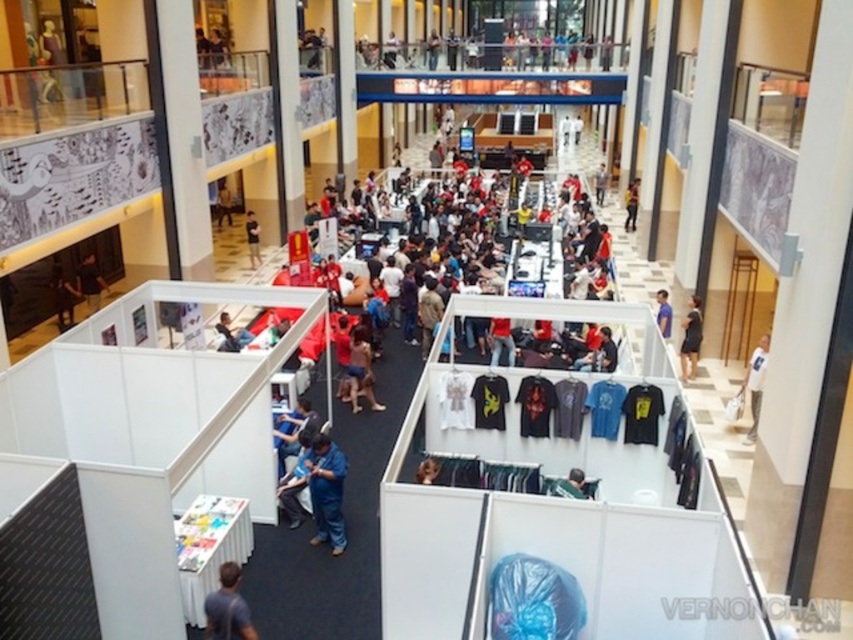
Question: Estimate the real-world distances between objects in this image. Which object is farther from the black fabric dress at lower right?

Choices:
 (A) blue fabric shirt at center
 (B) matte black shirt at center
 (C) yellow reflective vest at center

Answer: (B)

Question: Which object appears farthest from the camera in this image?

Choices:
 (A) blue fabric shirt at center
 (B) light brown skin at center

Answer: (A)

Question: Is blue fabric shirt at center behind yellow reflective vest at center?

Choices:
 (A) yes
 (B) no

Answer: (B)

Question: Which object is the farthest from the blue fabric shirt at center?

Choices:
 (A) blue jeans at lower center
 (B) yellow reflective vest at center
 (C) matte black shirt at center
 (D) dark blue shirt at lower center

Answer: (C)

Question: Observing the image, what is the correct spatial positioning of blue jeans at lower center in reference to blue fabric shirt at center?

Choices:
 (A) right
 (B) left

Answer: (B)

Question: Where is light brown skin at center located in relation to matte black shirt at center in the image?

Choices:
 (A) right
 (B) left

Answer: (A)